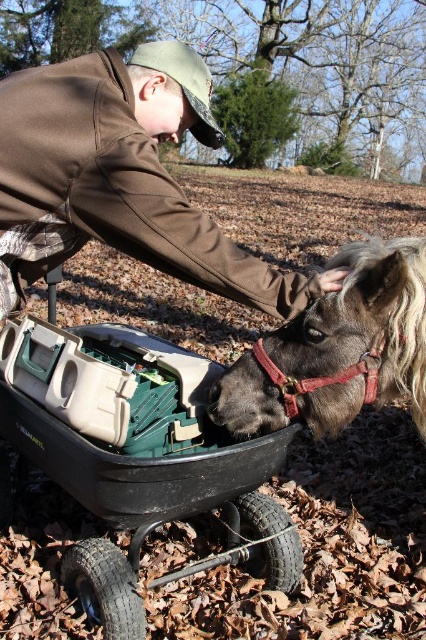
Question: Observing the image, what is the correct spatial positioning of black plastic wagon at lower center in reference to dark brown leather horse at center?

Choices:
 (A) left
 (B) right

Answer: (A)

Question: From the image, what is the correct spatial relationship of black plastic wagon at lower center in relation to brown soft jacket at center?

Choices:
 (A) right
 (B) left

Answer: (B)

Question: Is the position of black plastic wagon at lower center more distant than that of brown soft jacket at center?

Choices:
 (A) yes
 (B) no

Answer: (A)

Question: Among these points, which one is nearest to the camera?

Choices:
 (A) (127, 588)
 (B) (416, 252)

Answer: (B)

Question: Which point is closer to the camera?

Choices:
 (A) (112, 100)
 (B) (98, 416)

Answer: (A)

Question: Which object is positioned closest to the brown soft jacket at center?

Choices:
 (A) dark brown leather horse at center
 (B) black plastic wagon at lower center

Answer: (A)